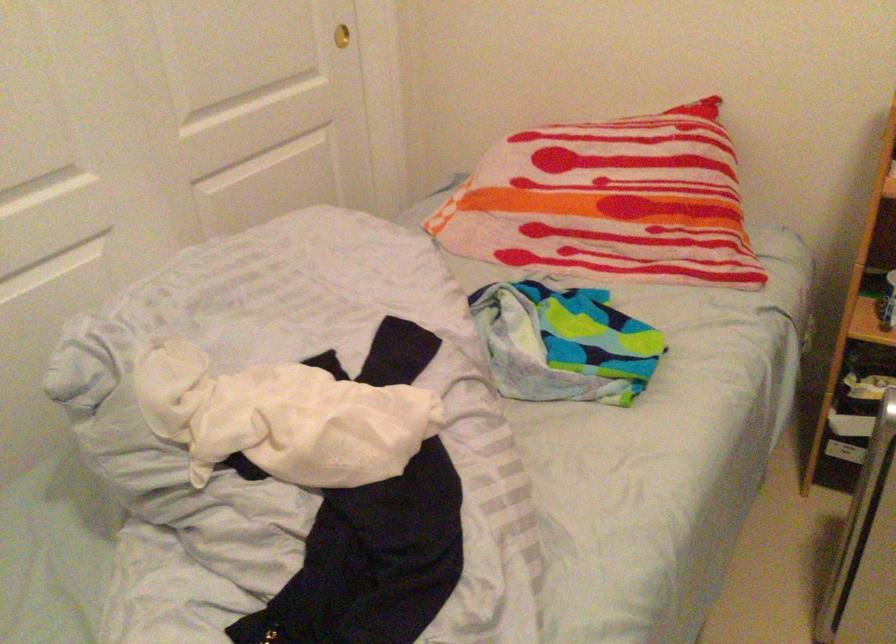
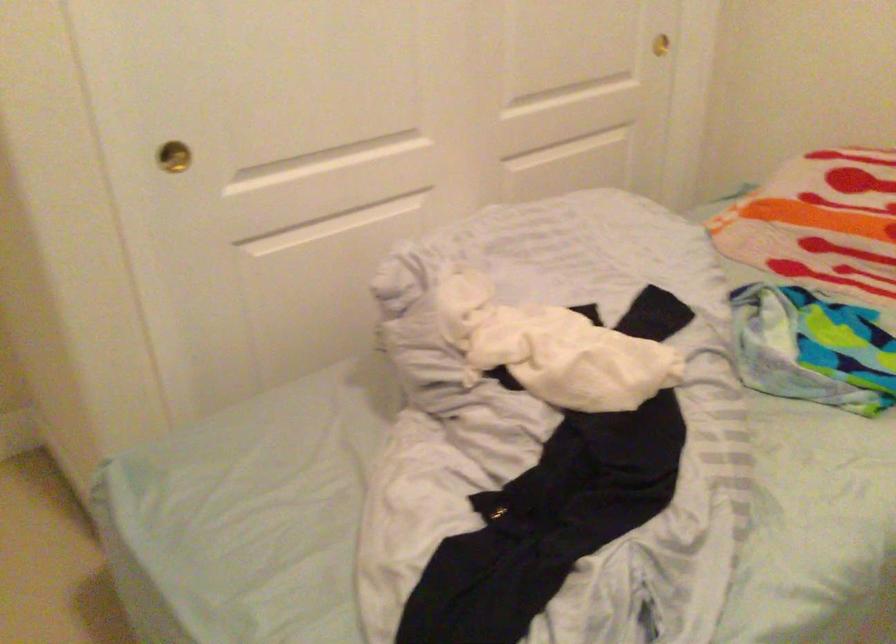
Question: In a continuous first-person perspective shot, in which direction is the camera moving?

Choices:
 (A) Left
 (B) Right
 (C) Forward
 (D) Backward

Answer: (D)